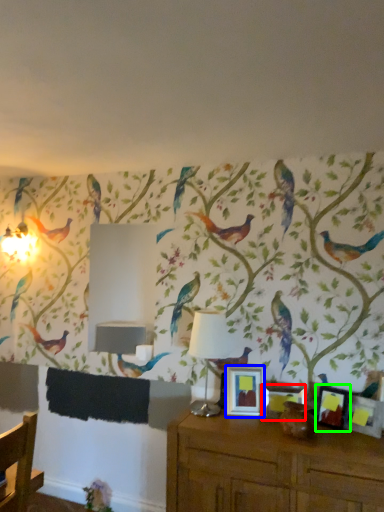
Question: Based on their relative distances, which object is nearer to picture frame (highlighted by a red box)? Choose from picture frame (highlighted by a blue box) and picture frame (highlighted by a green box).

Choices:
 (A) picture frame
 (B) picture frame

Answer: (A)